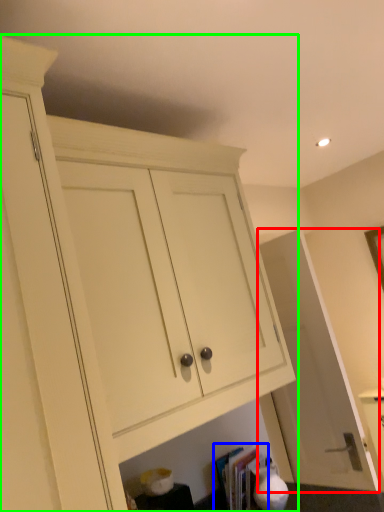
Question: Which is nearer to the door (highlighted by a red box)? book (highlighted by a blue box) or cabinetry (highlighted by a green box).

Choices:
 (A) book
 (B) cabinetry

Answer: (A)